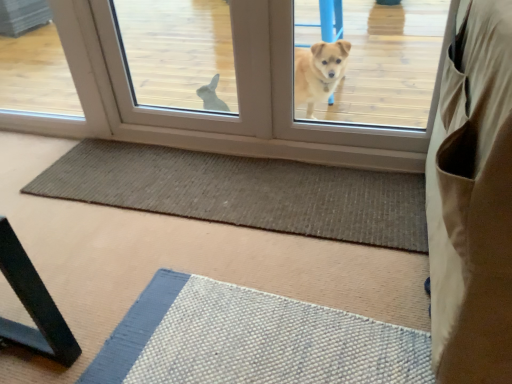
Describe the element at coordinates (244, 192) in the screenshot. I see `brown textured mat at center` at that location.

Identify the location of brown textured mat at center. (244, 192).

The width and height of the screenshot is (512, 384). Find the location of `brown textured mat at center`. brown textured mat at center is located at coordinates (244, 192).